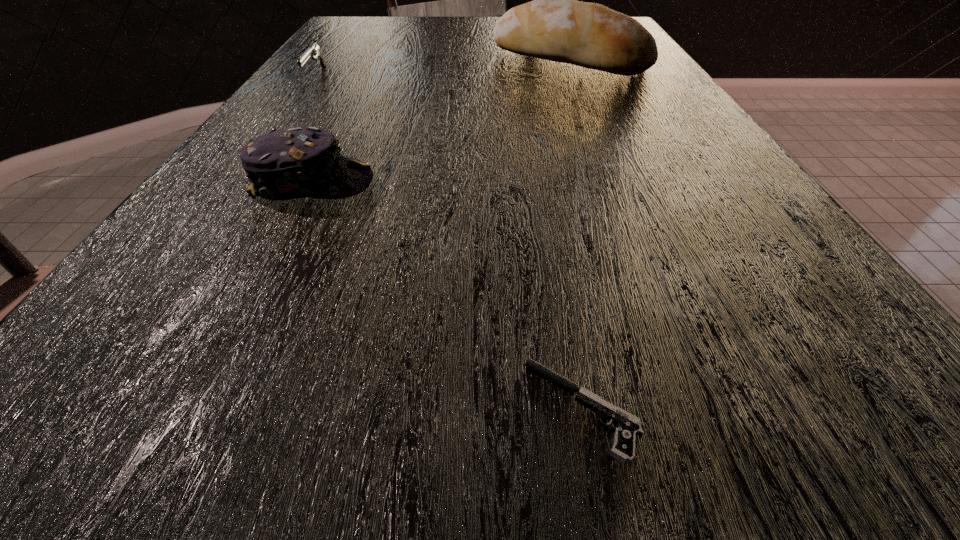
Where is `blank area located 0.260m at the barrel of the farthest pistol`? blank area located 0.260m at the barrel of the farthest pistol is located at coordinates [403, 19].

Locate an element on the screen. This screenshot has width=960, height=540. vacant region located 0.230m at the barrel of the farthest pistol is located at coordinates (413, 19).

Locate an element on the screen. This screenshot has width=960, height=540. free spot located on the front of the bread is located at coordinates click(x=592, y=112).

Find the location of a particular element. free location located 0.180m on the front-facing side of the headwear is located at coordinates (487, 184).

Locate an element on the screen. vacant area situated 0.400m on the front-facing side of the leftmost object is located at coordinates (233, 191).

Identify the location of vacant region located 0.400m on the front-facing side of the shortest pistol. The image size is (960, 540). (106, 408).

You are a GUI agent. You are given a task and a screenshot of the screen. Output one action in this format:
    pyautogui.click(x=<x>, y=<y>)
    Task: Click on the free space located 0.380m on the front-facing side of the shortest pistol
    The height and width of the screenshot is (540, 960).
    Given the screenshot: What is the action you would take?
    pyautogui.click(x=127, y=408)

Find the location of `vacant space located on the front-facing side of the shortest pistol`. vacant space located on the front-facing side of the shortest pistol is located at coordinates (465, 408).

What are the coordinates of `object situated at the far edge` in the screenshot? It's located at pos(526,0).

The height and width of the screenshot is (540, 960). I want to click on object located at the near edge, so click(628, 426).